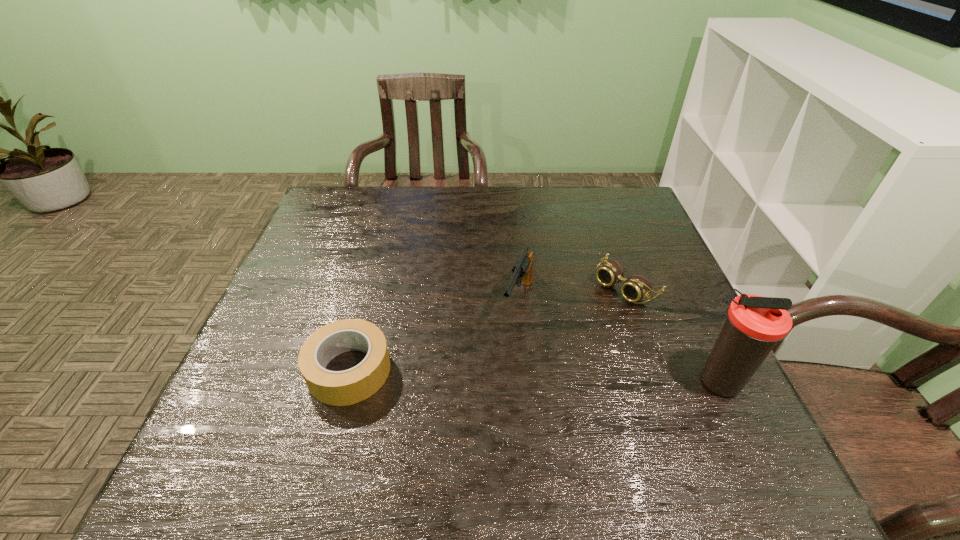
This screenshot has width=960, height=540. What are the coordinates of `vacant spot on the desktop that is between the duct tape and the thermos bottle and is positioned through the lenses of the goggles` in the screenshot? It's located at (510, 375).

Where is `free spot on the desktop that is between the leftmost object and the tallest object and is positioned along the barrel of the gun`? Image resolution: width=960 pixels, height=540 pixels. free spot on the desktop that is between the leftmost object and the tallest object and is positioned along the barrel of the gun is located at coordinates (486, 374).